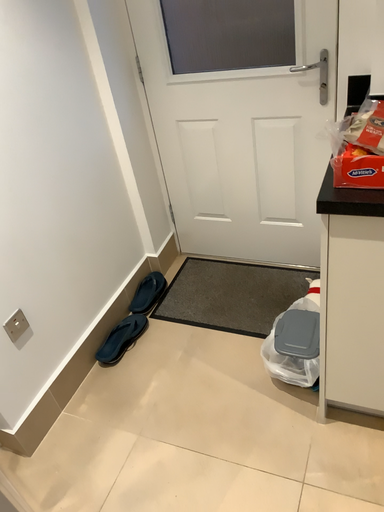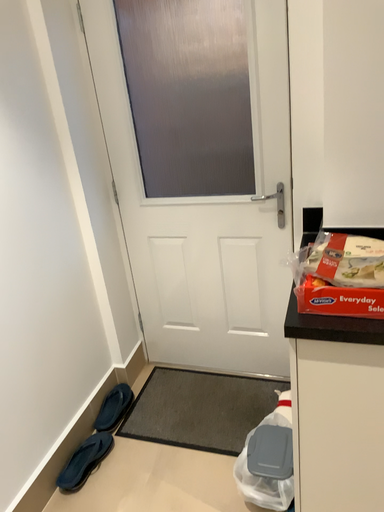
Question: Which way did the camera rotate in the video?

Choices:
 (A) rotated downward
 (B) rotated upward

Answer: (B)